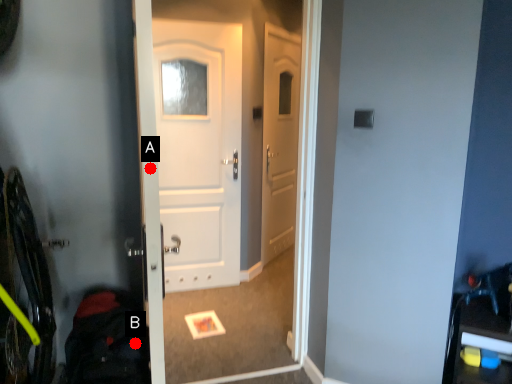
Question: Two points are circled on the image, labeled by A and B beside each circle. Which point is farther to the camera?

Choices:
 (A) A is further
 (B) B is further

Answer: (B)